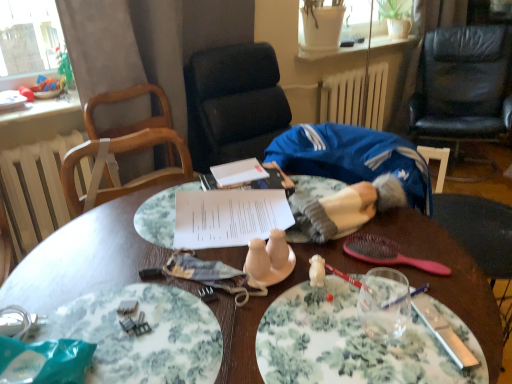
Question: Does white paper at center have a smaller size compared to wooden table at center?

Choices:
 (A) yes
 (B) no

Answer: (A)

Question: Is white paper at center located outside wooden table at center?

Choices:
 (A) no
 (B) yes

Answer: (B)

Question: Considering the relative sizes of white paper at center and wooden table at center in the image provided, is white paper at center shorter than wooden table at center?

Choices:
 (A) no
 (B) yes

Answer: (B)

Question: Could you tell me if white paper at center is turned towards wooden table at center?

Choices:
 (A) no
 (B) yes

Answer: (A)

Question: From a real-world perspective, is white paper at center over wooden table at center?

Choices:
 (A) yes
 (B) no

Answer: (A)

Question: From the image's perspective, is white paper at center located above wooden table at center?

Choices:
 (A) yes
 (B) no

Answer: (A)

Question: Considering the relative positions of floral-patterned plate at lower left, the first plate viewed from the left, and pink plastic spoon at lower right in the image provided, is floral-patterned plate at lower left, the first plate viewed from the left, to the left of pink plastic spoon at lower right from the viewer's perspective?

Choices:
 (A) yes
 (B) no

Answer: (A)

Question: From the image's perspective, is floral-patterned plate at lower left, which is counted as the 2th plate, starting from the right, located beneath pink plastic spoon at lower right?

Choices:
 (A) no
 (B) yes

Answer: (B)

Question: From a real-world perspective, is floral-patterned plate at lower left, the first plate viewed from the left, physically above pink plastic spoon at lower right?

Choices:
 (A) yes
 (B) no

Answer: (B)

Question: Is floral-patterned plate at lower left, the first plate viewed from the left, touching pink plastic spoon at lower right?

Choices:
 (A) no
 (B) yes

Answer: (A)

Question: From the image's perspective, is floral-patterned plate at lower left, which is counted as the 2th plate, starting from the right, above pink plastic spoon at lower right?

Choices:
 (A) yes
 (B) no

Answer: (B)

Question: Is floral-patterned plate at lower left, which is counted as the 2th plate, starting from the right, far away from pink plastic spoon at lower right?

Choices:
 (A) no
 (B) yes

Answer: (A)

Question: Is white matte radiator at upper center, the 2th radiator positioned from the front, closer to camera compared to white radiator at left, the 1th radiator ordered from the bottom?

Choices:
 (A) yes
 (B) no

Answer: (B)